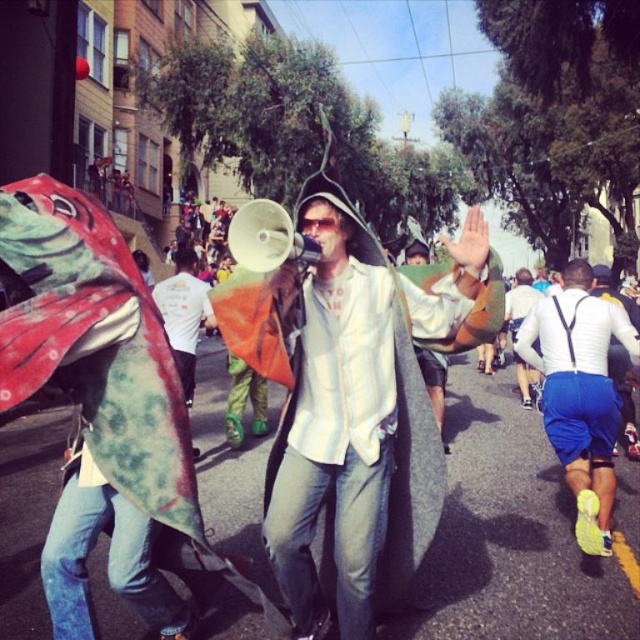
Question: Is white striped shirt at center positioned at the back of white matte shorts at lower right?

Choices:
 (A) yes
 (B) no

Answer: (B)

Question: Is white striped shirt at center to the right of white matte shorts at lower right from the viewer's perspective?

Choices:
 (A) yes
 (B) no

Answer: (B)

Question: Which point is farther to the camera?

Choices:
 (A) white matte shorts at lower right
 (B) white striped shirt at center

Answer: (A)

Question: Can you confirm if white striped shirt at center is wider than white matte shorts at lower right?

Choices:
 (A) no
 (B) yes

Answer: (B)